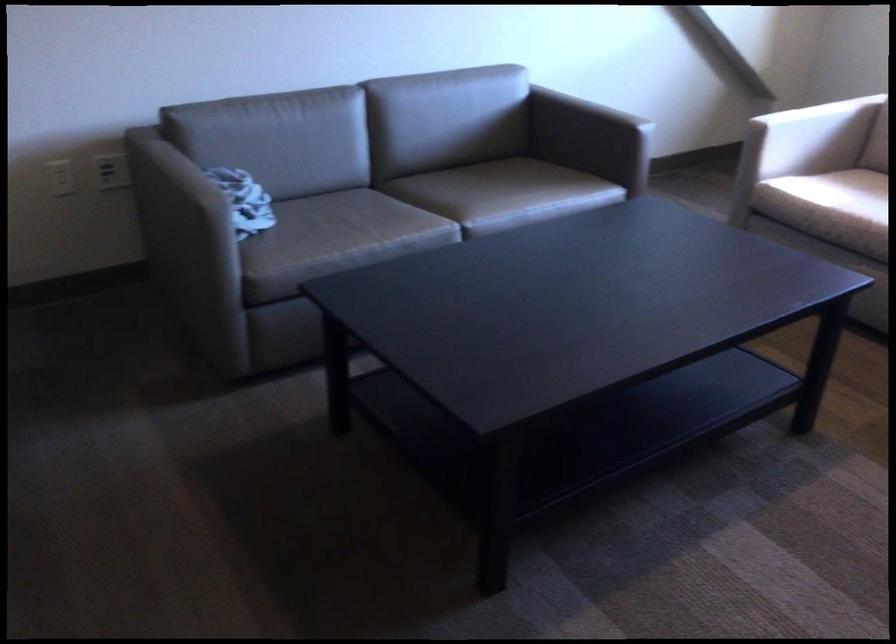
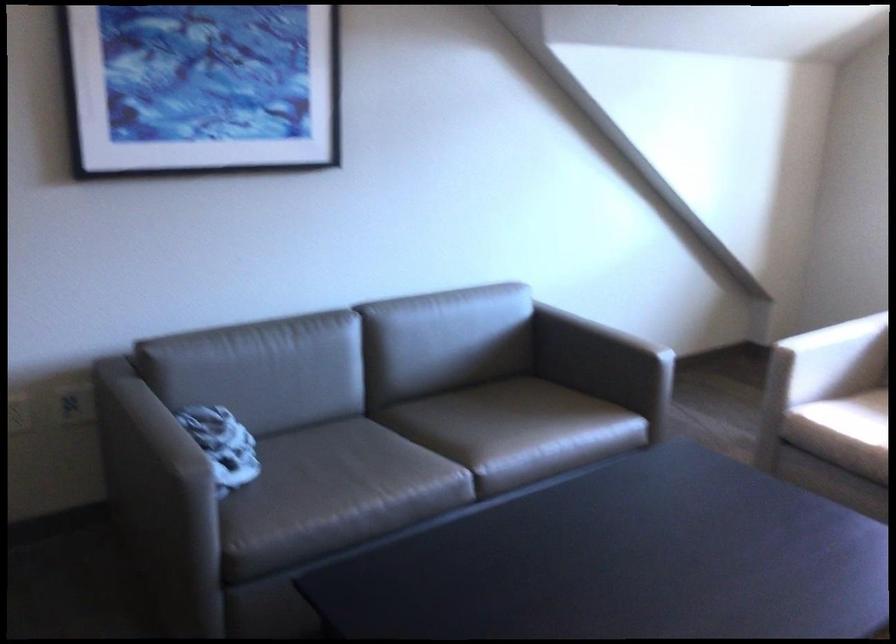
Question: The images are taken continuously from a first-person perspective. In which direction is your viewpoint rotating?

Choices:
 (A) Left
 (B) Right
 (C) Up
 (D) Down

Answer: (C)